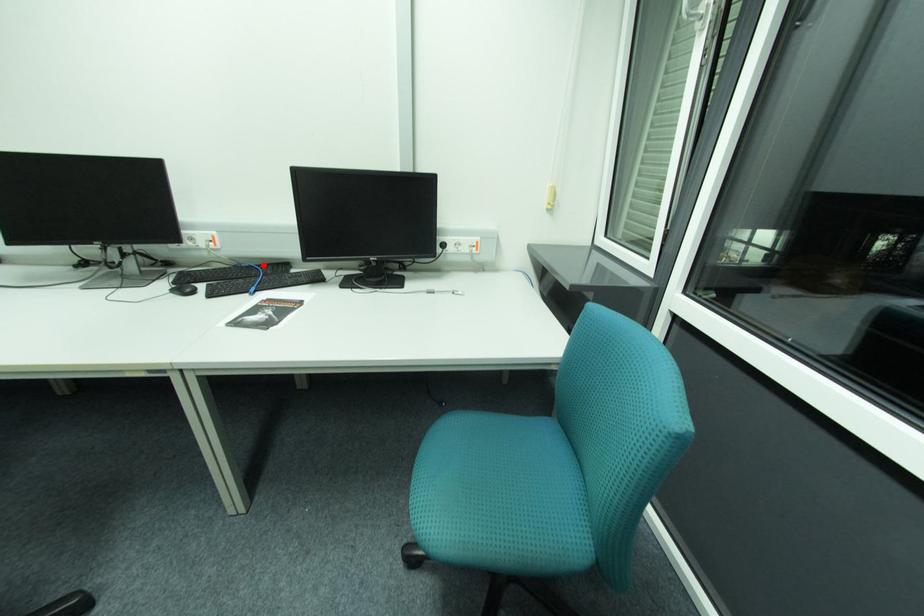
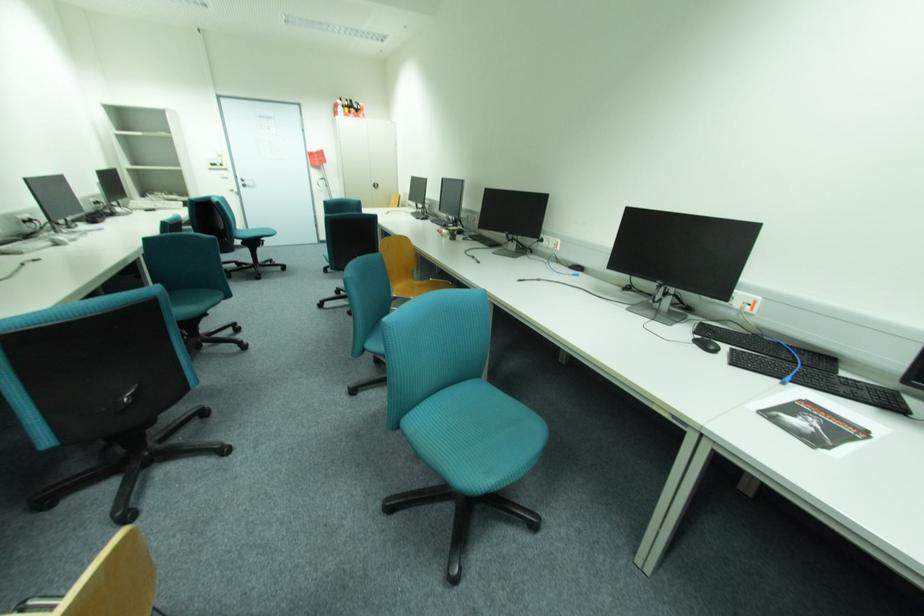
The point at the highlighted location is marked in the first image. Where is the corresponding point in the second image?

(796, 347)